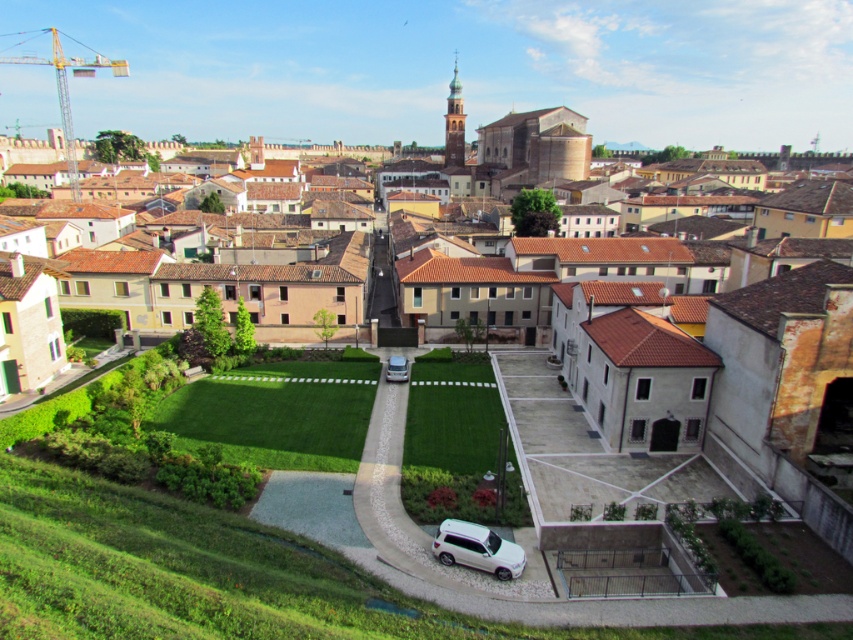
You are a delivery driver who needs to park your truck in the courtyard. The courtyard has a low wall and a garden with shrubs and flowers. There are two cars already parked there. Can you park your truck between the white matte car at lower center and the silver metallic car at center?

The white matte car at lower center is positioned under the silver metallic car at center, meaning they are stacked vertically. Since the silver metallic car at center is above the white matte car at lower center, there is no space between them for the truck to park.

You are a visitor arriving at the town and see the white matte car at lower center and the silver metallic car at center. Which car is positioned closer to the right side of the scene?

The white matte car at lower center is to the right of the silver metallic car at center, so it is positioned closer to the right side of the scene.

You are a delivery driver approaching the entrance of the courtyard. You see the white matte car at lower center and the silver metallic car at center. Which car is blocking your path to the entrance?

The white matte car at lower center is in front of the silver metallic car at center, so it is blocking your path to the entrance.